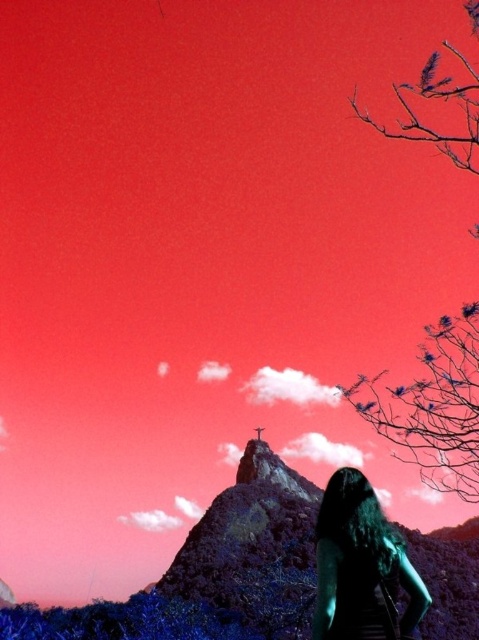
This screenshot has height=640, width=479. What are the coordinates of `smooth bark tree at right` in the screenshot? It's located at [433, 406].

Which is behind, point (466, 138) or point (410, 602)?

Positioned behind is point (466, 138).

Where is `smooth bark tree at right`? The width and height of the screenshot is (479, 640). smooth bark tree at right is located at coordinates (433, 406).